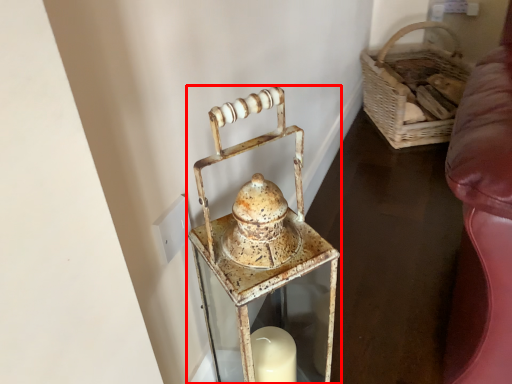
Question: Where is lantern (annotated by the red box) located in relation to basket in the image?

Choices:
 (A) right
 (B) left

Answer: (B)